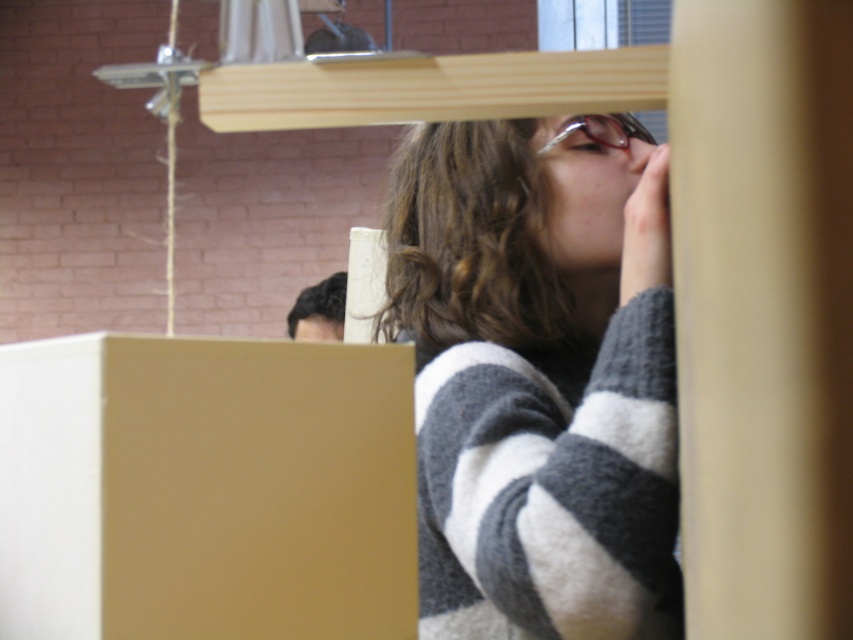
Between matte cardboard box at lower left and clear plastic goggles at upper center, which one is positioned higher?

clear plastic goggles at upper center is higher up.

Describe the element at coordinates (206, 490) in the screenshot. I see `matte cardboard box at lower left` at that location.

You are a GUI agent. You are given a task and a screenshot of the screen. Output one action in this format:
    pyautogui.click(x=<x>, y=<y>)
    Task: Click on the matte cardboard box at lower left
    Image resolution: width=853 pixels, height=640 pixels.
    Given the screenshot: What is the action you would take?
    pyautogui.click(x=206, y=490)

Is striped sweater at upper right below matte cardboard box at lower left?

Actually, striped sweater at upper right is above matte cardboard box at lower left.

Consider the image. Can you confirm if striped sweater at upper right is positioned to the left of matte cardboard box at lower left?

Incorrect, striped sweater at upper right is not on the left side of matte cardboard box at lower left.

Locate an element on the screen. The width and height of the screenshot is (853, 640). striped sweater at upper right is located at coordinates (537, 380).

Does striped sweater at upper right have a greater height compared to clear plastic goggles at upper center?

Yes.

Where is `striped sweater at upper right`? striped sweater at upper right is located at coordinates [x=537, y=380].